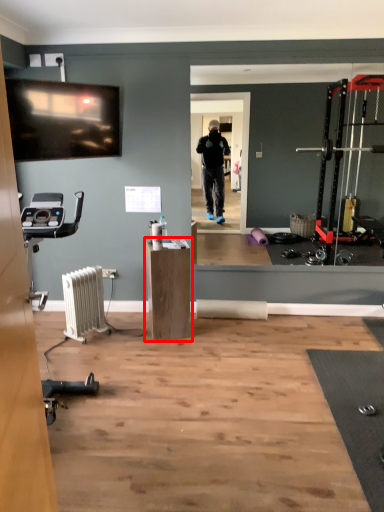
Question: From the image's perspective, what is the correct spatial relationship of furniture (annotated by the red box) in relation to radiator?

Choices:
 (A) above
 (B) below

Answer: (A)